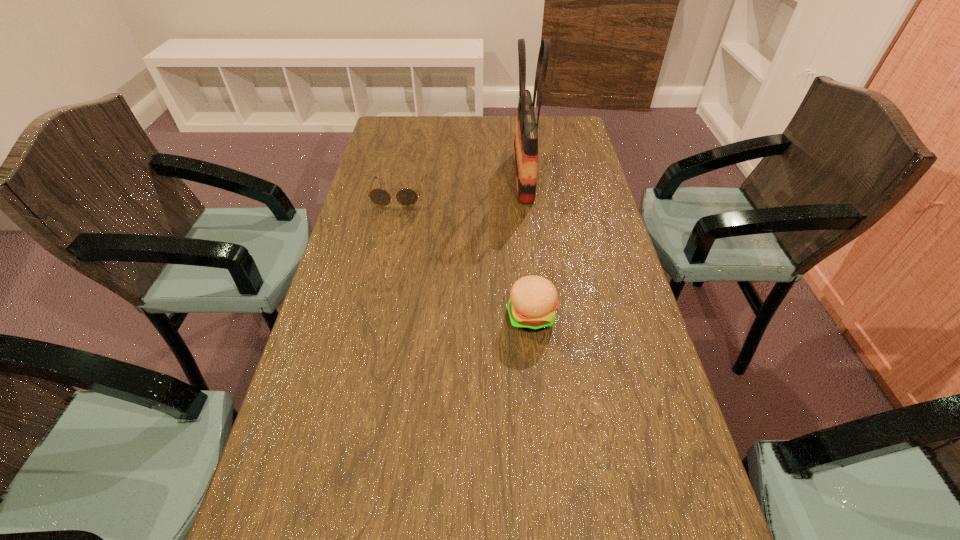
At what (x,y) coordinates should I click in order to perform the action: click on free area in between the tallest object and the second shortest object. Please return your answer as a coordinate pair (x, y). Image resolution: width=960 pixels, height=540 pixels. Looking at the image, I should click on (527, 246).

Identify the location of object that is the second closest to the hamburger. (406, 197).

Identify the location of object that ranks as the second closest to the tallest object. (533, 300).

Image resolution: width=960 pixels, height=540 pixels. Find the location of `free region that satisfies the following two spatial constraints: 1. on the front-facing side of the tallest object; 2. on the lenses of the shortest object`. free region that satisfies the following two spatial constraints: 1. on the front-facing side of the tallest object; 2. on the lenses of the shortest object is located at coordinates (525, 194).

Locate an element on the screen. This screenshot has height=540, width=960. free space that satisfies the following two spatial constraints: 1. on the front-facing side of the shopping bag; 2. on the lenses of the sunglasses is located at coordinates (525, 194).

The width and height of the screenshot is (960, 540). Find the location of `vacant area in the image that satisfies the following two spatial constraints: 1. on the front-facing side of the tallest object; 2. on the front side of the hamburger`. vacant area in the image that satisfies the following two spatial constraints: 1. on the front-facing side of the tallest object; 2. on the front side of the hamburger is located at coordinates (540, 316).

Image resolution: width=960 pixels, height=540 pixels. Identify the location of free space that satisfies the following two spatial constraints: 1. on the lenses of the hamburger; 2. on the right side of the leftmost object. (371, 316).

Where is `vacant space that satisfies the following two spatial constraints: 1. on the lenses of the shortest object; 2. on the right side of the hamburger`? vacant space that satisfies the following two spatial constraints: 1. on the lenses of the shortest object; 2. on the right side of the hamburger is located at coordinates (371, 316).

Image resolution: width=960 pixels, height=540 pixels. In order to click on vacant area that satisfies the following two spatial constraints: 1. on the lenses of the shortest object; 2. on the right side of the hamburger in this screenshot , I will do `click(371, 316)`.